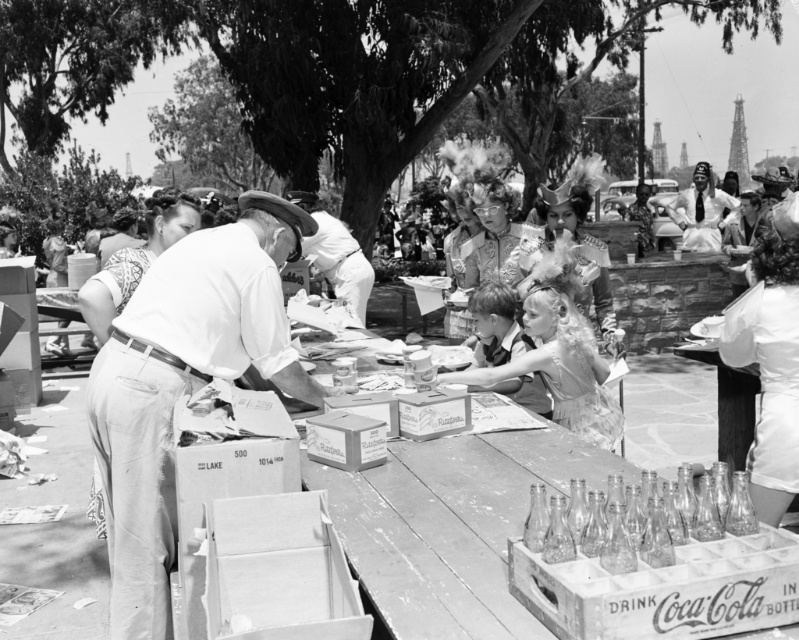
Question: In this image, where is clear glass bottles at lower right located relative to transparent glass bottles at lower center?

Choices:
 (A) left
 (B) right

Answer: (B)

Question: Which point appears closest to the camera in this image?

Choices:
 (A) (328, 227)
 (B) (169, 372)

Answer: (B)

Question: Among these objects, which one is farthest from the camera?

Choices:
 (A) clear glass bottles at lower right
 (B) cardboard box at center

Answer: (B)

Question: Based on their relative distances, which object is farther from the cardboard box at center?

Choices:
 (A) smooth white shirt at center
 (B) clear glass bottles at lower right
 (C) light gray cotton shirt at center

Answer: (A)

Question: From the image, what is the correct spatial relationship of cardboard box at center in relation to matte cardboard box at center?

Choices:
 (A) below
 (B) above

Answer: (A)

Question: Does cardboard box at center appear on the left side of smooth white shirt at center?

Choices:
 (A) no
 (B) yes

Answer: (A)